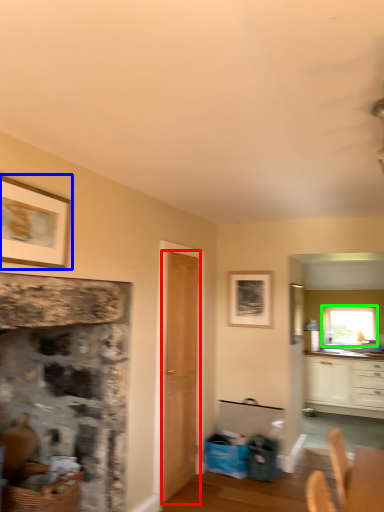
Question: Based on their relative distances, which object is nearer to door (highlighted by a red box)? Choose from picture frame (highlighted by a blue box) and window (highlighted by a green box).

Choices:
 (A) picture frame
 (B) window

Answer: (A)